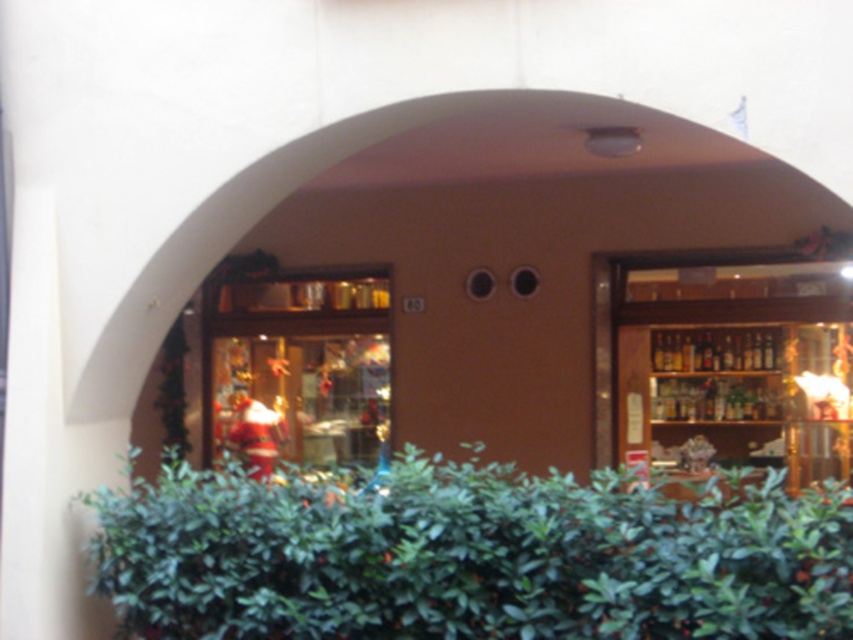
Question: Does wooden shelves at center have a greater width compared to santa claus figure at center?

Choices:
 (A) no
 (B) yes

Answer: (A)

Question: Which point is closer to the camera taking this photo?

Choices:
 (A) (334, 340)
 (B) (558, 596)
 (C) (828, 282)

Answer: (B)

Question: Does green leafy hedge at lower center have a smaller size compared to santa claus figure at center?

Choices:
 (A) no
 (B) yes

Answer: (B)

Question: Which point is closer to the camera?

Choices:
 (A) green leafy hedge at lower center
 (B) wooden shelves at center

Answer: (A)

Question: Which point is closer to the camera?

Choices:
 (A) (264, 340)
 (B) (845, 426)
 (C) (434, 460)

Answer: (C)

Question: Is wooden shelves at center smaller than santa claus figure at center?

Choices:
 (A) yes
 (B) no

Answer: (A)